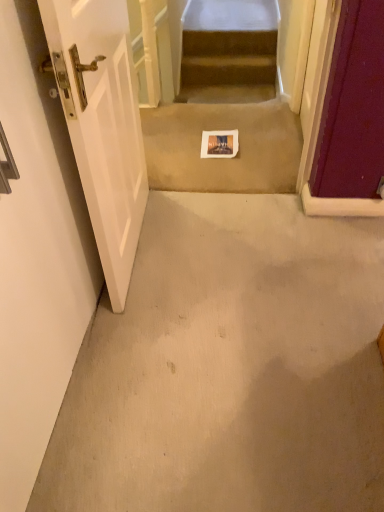
The image size is (384, 512). Identify the location of white matte door at left. (37, 256).

What do you see at coordinates (37, 256) in the screenshot? I see `white matte door at left` at bounding box center [37, 256].

Measure the distance between point (47, 316) and camera.

They are 1.12 meters apart.

Identify the location of white matte door at left. The width and height of the screenshot is (384, 512). (37, 256).